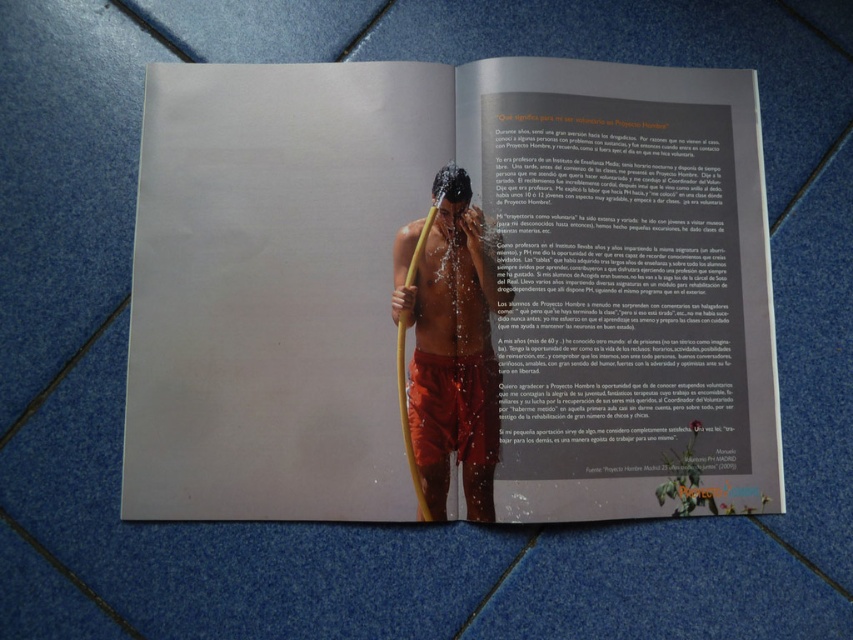
You are designing a layout for a magazine spread and need to ensure that the matte yellow hose at center and the shiny orange shorts at center are visually balanced. Given their sizes, which object should be placed closer to the center of the page to maintain balance?

The matte yellow hose at center should be placed closer to the center of the page because it has a greater height compared to the shiny orange shorts at center, making it visually heavier. This placement helps balance the composition.

You are a photographer trying to capture the man in the red shorts holding the yellow hose. You want to focus on the point that is closer to the camera. Which point should you focus on, point (314,218) or point (450,205)?

You should focus on point (314,218) because it is in front of point (450,205), making it closer to the camera.